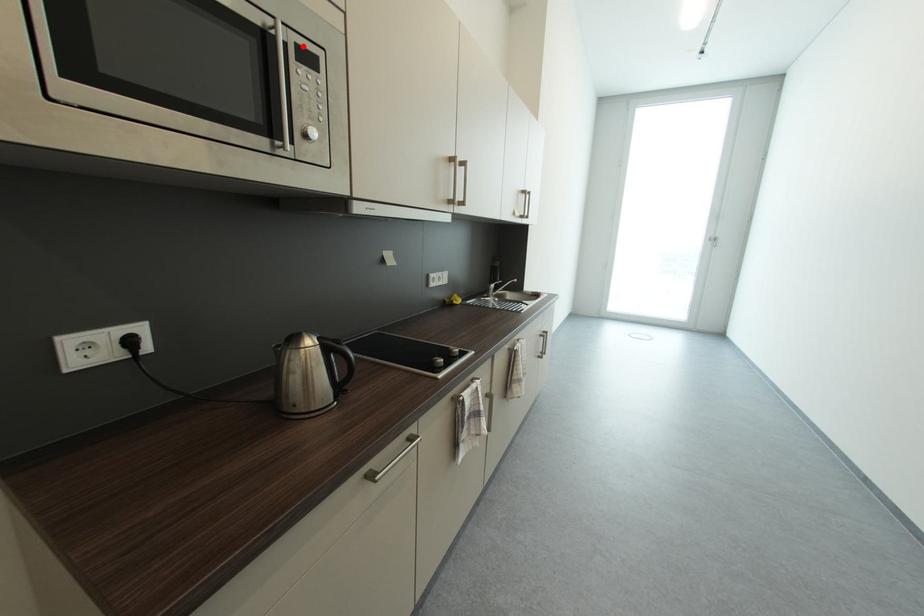
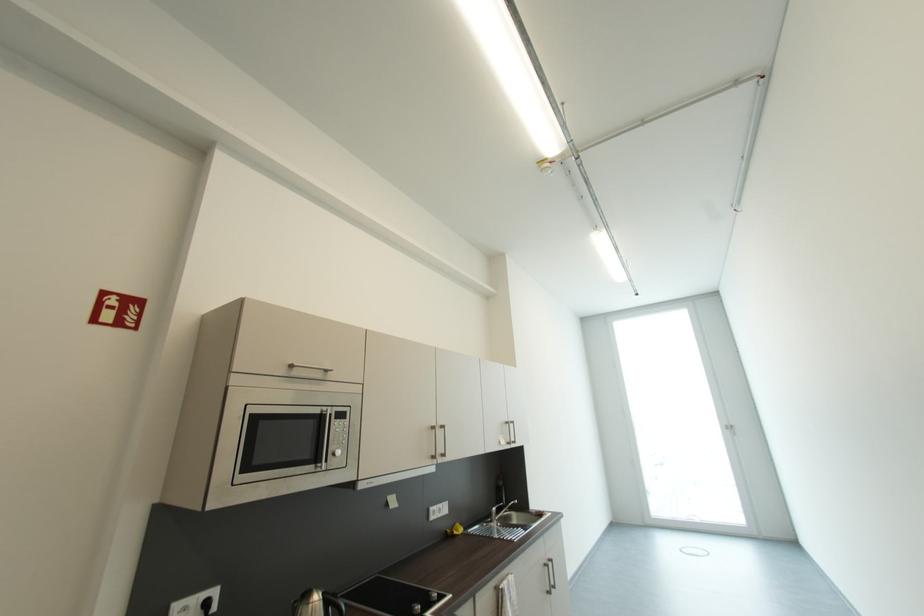
Find the pixel in the second image that matches the highlighted location in the first image.

(342, 413)